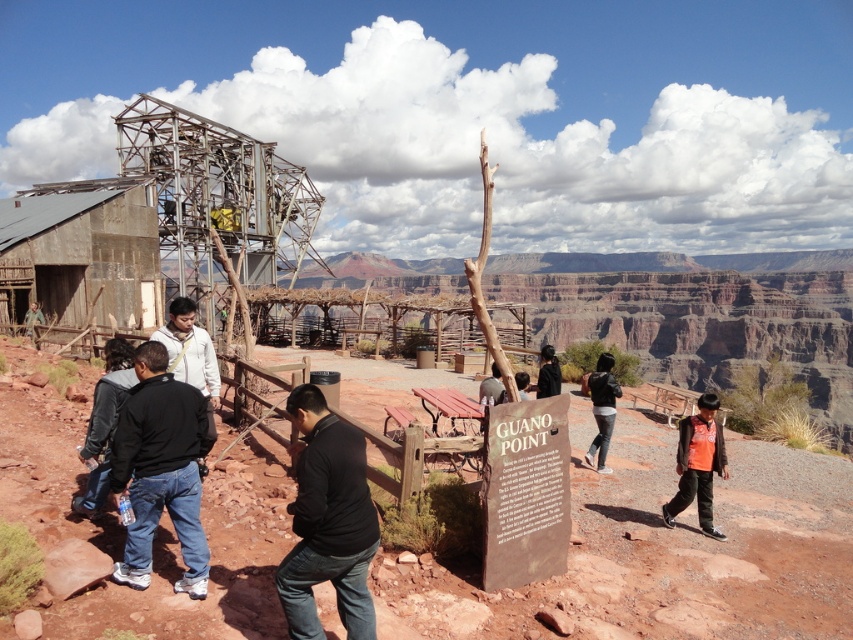
You are a park ranger at Guano Point and need to locate a hiker wearing a black matte jacket at center. According to the map coordinates, where should you look for them?

The black matte jacket at center is located at coordinates point (328, 520).

You are a photographer at Guano Point and want to capture both the dark gray jacket at lower left and the dark gray jacket at center in the same frame. Which jacket should you focus on first to ensure both are in the shot?

You should focus on the dark gray jacket at center first because the dark gray jacket at lower left is positioned under it, meaning adjusting the camera angle to include the lower jacket might require a wider shot or lower perspective to include both.